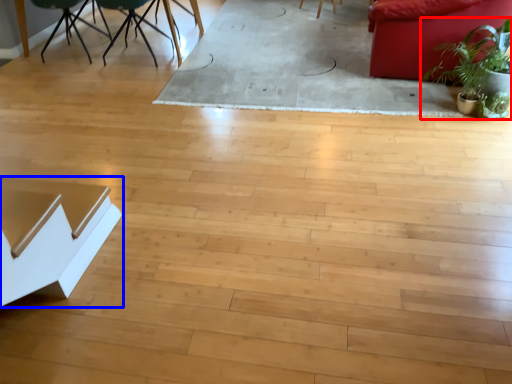
Question: Which object appears closest to the camera in this image, houseplant (highlighted by a red box) or table (highlighted by a blue box)?

Choices:
 (A) houseplant
 (B) table

Answer: (B)